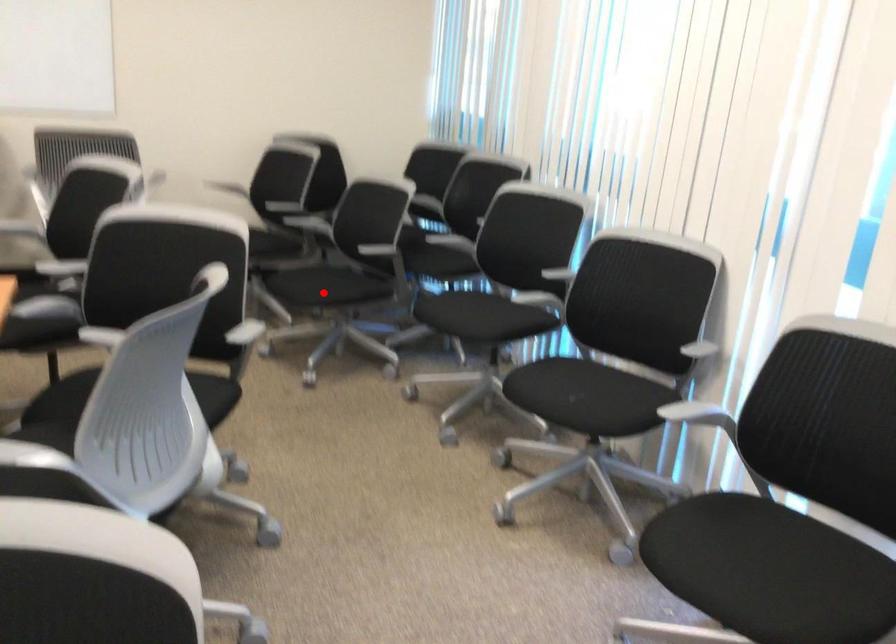
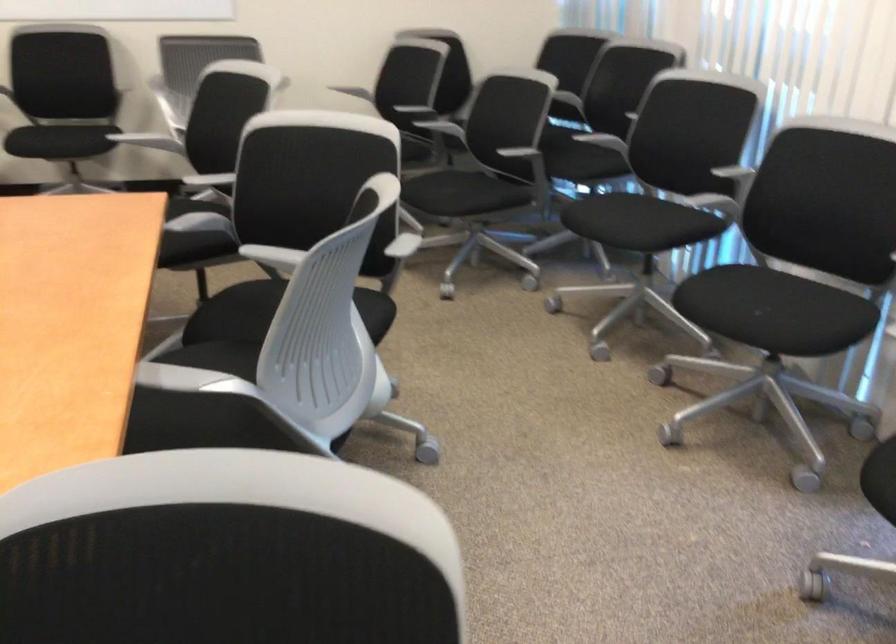
Find the pixel in the second image that matches the highlighted location in the first image.

(462, 200)